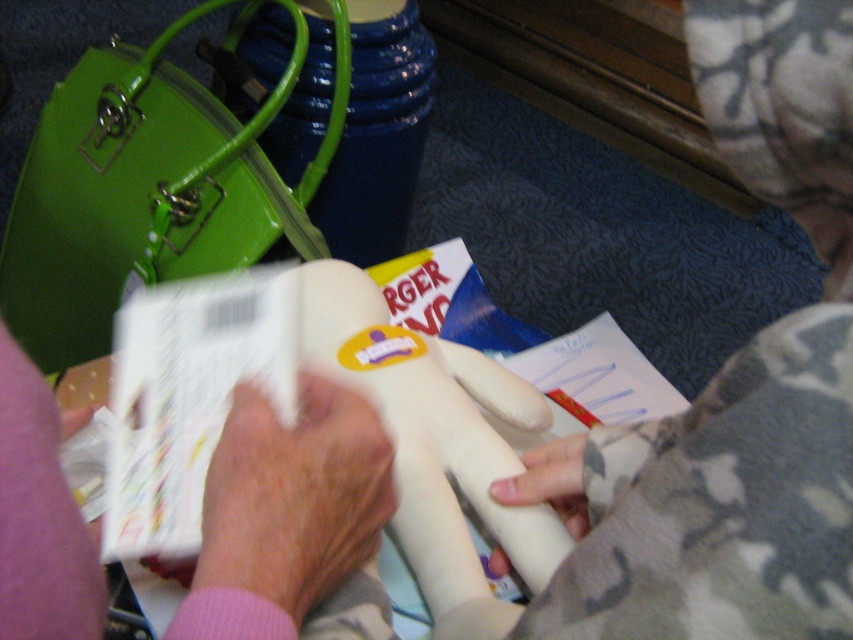
You are organizing a photo album and want to describe the arrangement of the pink fabric at center and the white matte foam at center in the image. Which object is positioned higher in the image?

The pink fabric at center is located above the white matte foam at center, so it is positioned higher in the image.

Please provide the 2D coordinates of the pink fabric at center in the image. The coordinates should be in the format of a point like this example format of point format is a tuple with two numbers between 0 and 1, such as 0.5, 0.5. The first number is the x coordinate, the second is the y coordinate. The origin is the bottom left corner of the image. The x increases to the right, y increases upward.

The 2D coordinates of the pink fabric at center are at point (293, 499).

You are a photographer setting up a photo shoot with the pink fabric at center and the white matte foam at center. You need to position them so that one is taller than the other. Which object should you place higher to maintain their natural height?

The pink fabric at center is much taller than the white matte foam at center, so you should place the pink fabric at center higher to maintain their natural height.